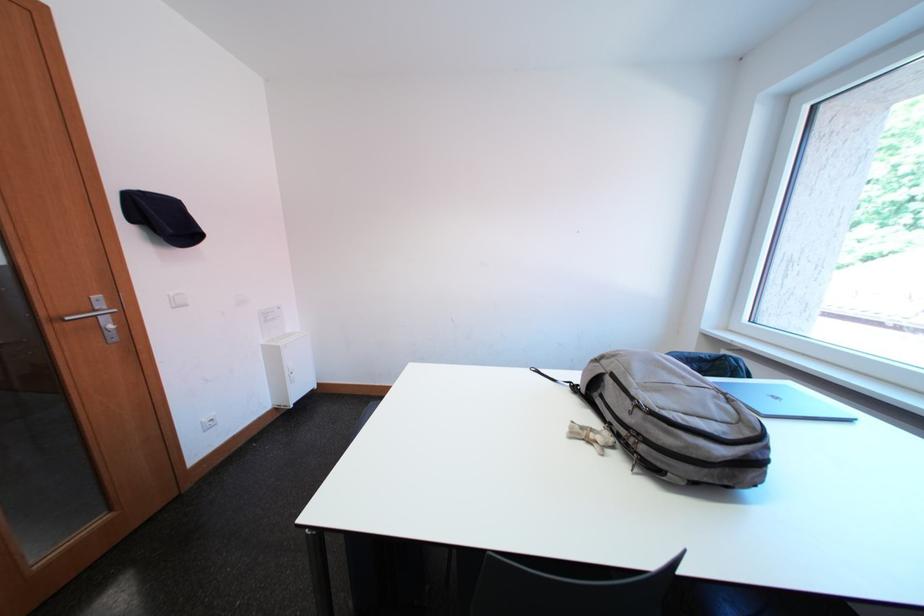
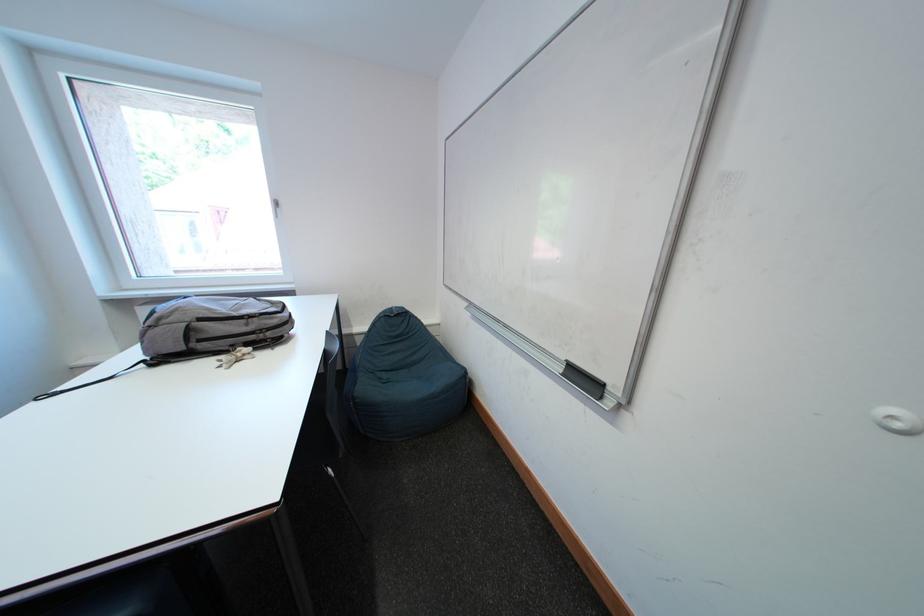
First-person continuous shooting, in which direction is the camera rotating?

The camera rotated toward right-down.